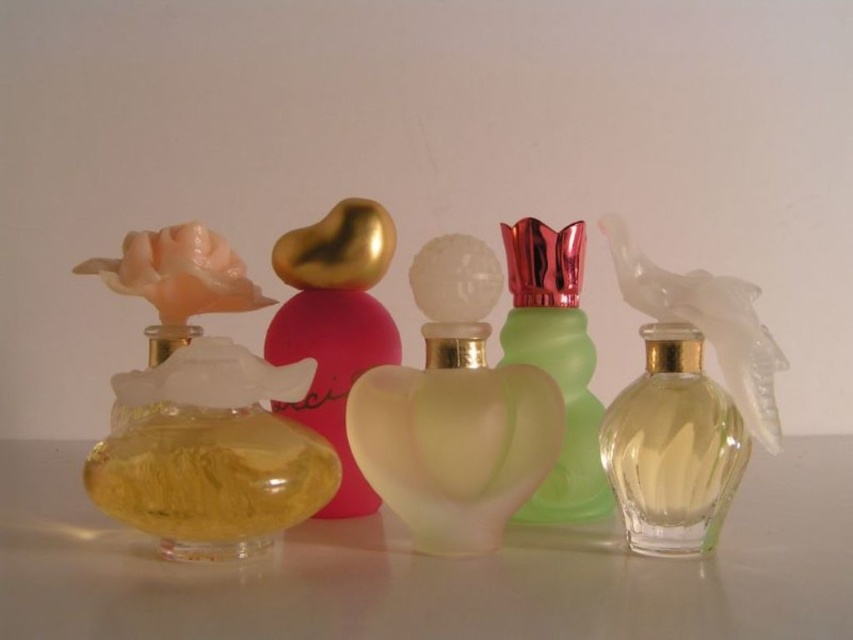
You are organizing a perfume display and need to place the clear glass perfume at center right and the translucent yellow liquid at left. Which one requires more space due to its size?

The translucent yellow liquid at left requires more space because it is larger than the clear glass perfume at center right.

You are organizing a display of perfume bottles. You need to place a new bottle that is 10 cm wide between the clear glass perfume at center right and the translucent yellow liquid at left. Can the new bottle fit between them based on their widths?

The clear glass perfume at center right is narrower than the translucent yellow liquid at left. Since the new bottle is 10 cm wide, you need to check the available space between them. However, without knowing the exact distance between the two bottles, we cannot determine if the 10 cm wide bottle will fit. Please measure the space between them first.

You are organizing a display of perfume bottles. You have a translucent yellow glass at left and a clear glass perfume at center right. Which bottle is taller?

The translucent yellow glass at left is taller than the clear glass perfume at center right according to the description.